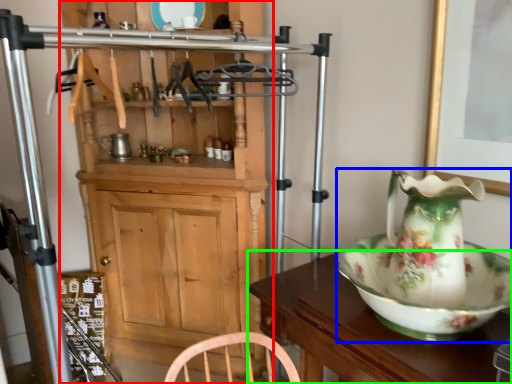
Question: Which object is the closest to the cabinetry (highlighted by a red box)? Choose among these: jug (highlighted by a blue box) or table (highlighted by a green box).

Choices:
 (A) jug
 (B) table

Answer: (B)